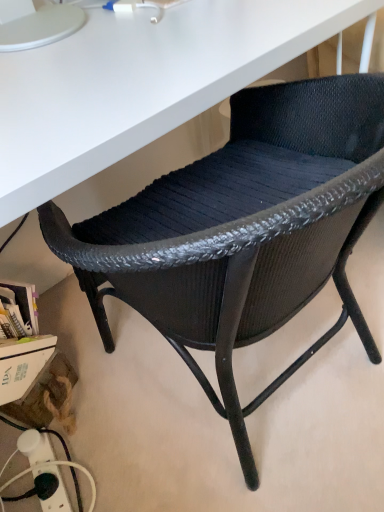
I want to click on vacant region to the left of black plastic power strip at lower left, so click(x=15, y=484).